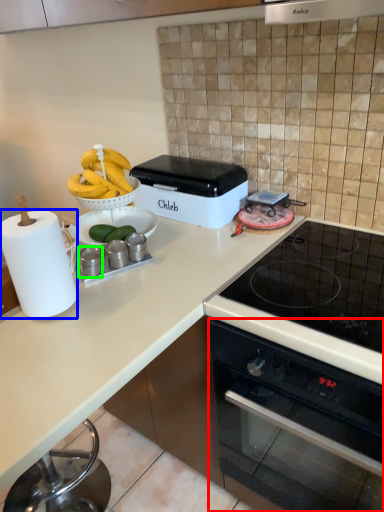
Question: Which object is positioned farthest from oven (highlighted by a red box)? Select from paper towel (highlighted by a blue box) and appliance (highlighted by a green box).

Choices:
 (A) paper towel
 (B) appliance

Answer: (B)